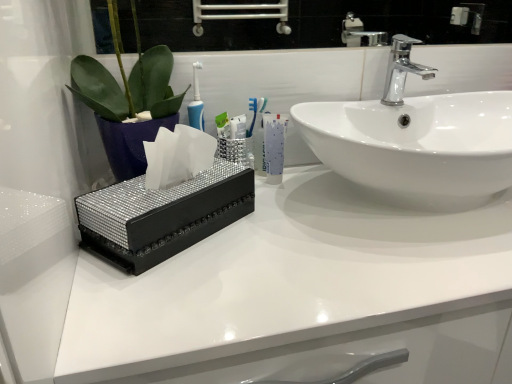
Where is `free space in front of white glossy mouthwash at center`? This screenshot has height=384, width=512. free space in front of white glossy mouthwash at center is located at coordinates (290, 214).